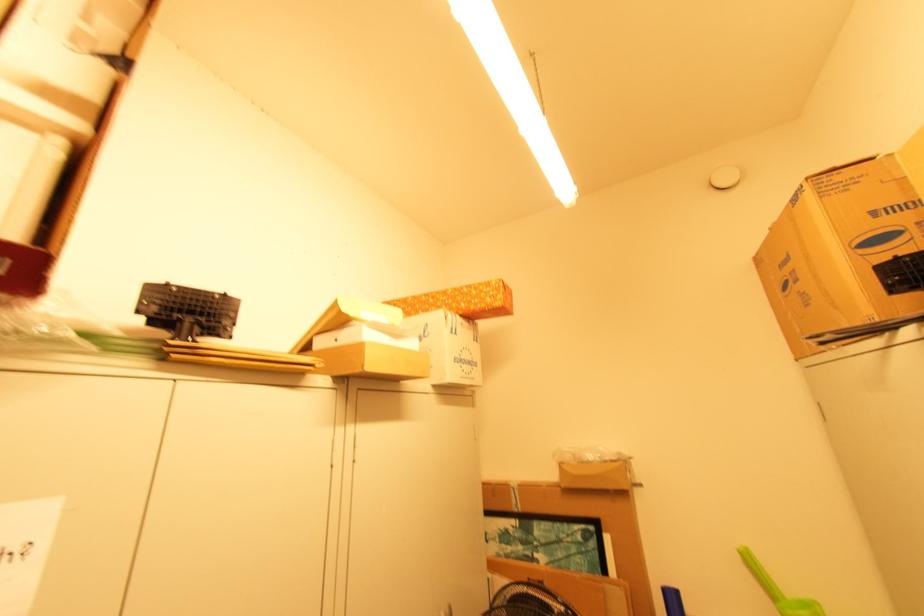
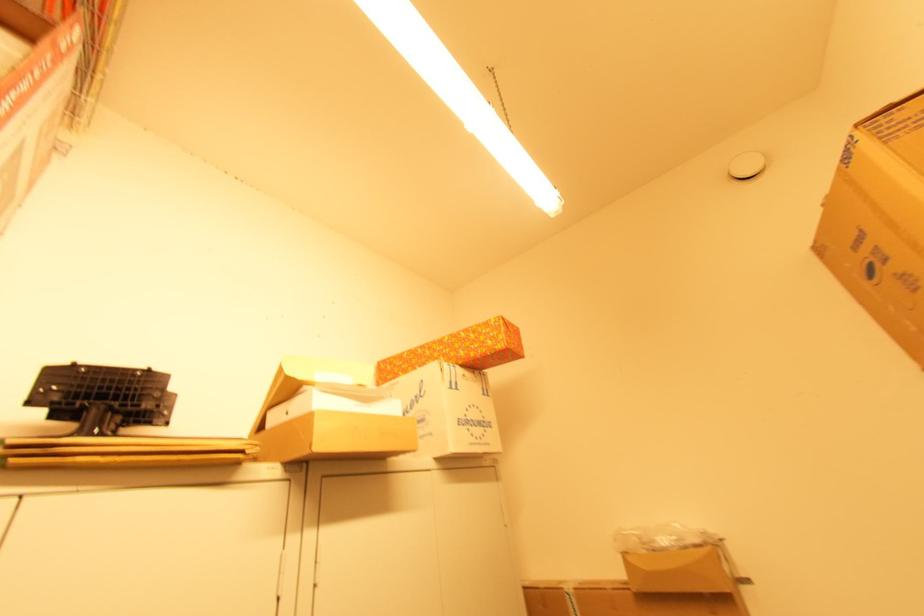
Which direction would the cameraman need to move to produce the second image?

The cameraman moved toward right, forward.